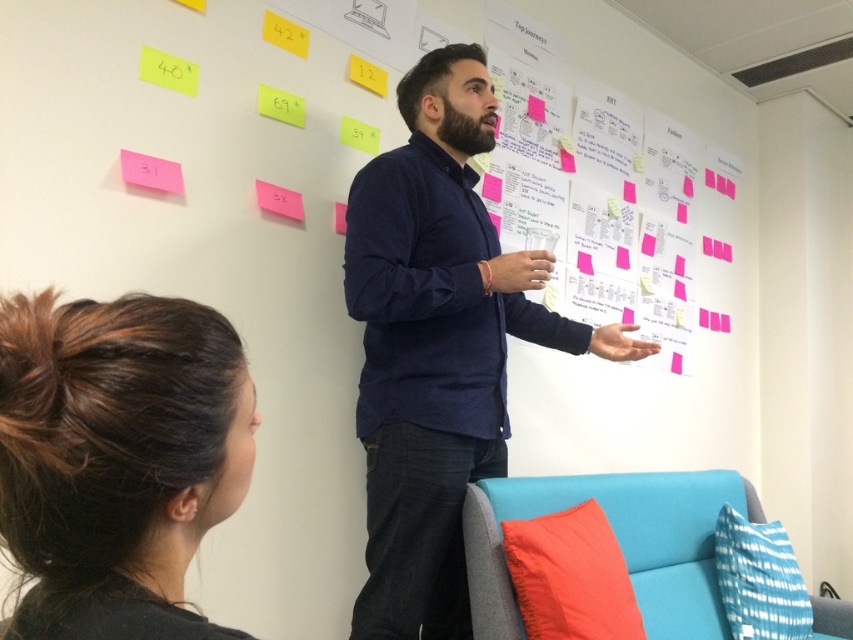
You are an observer in the office scene. You notice the dark blue shirt at center and the yellow paper at upper left. Which object is taller?

The dark blue shirt at center is taller than the yellow paper at upper left.

You are an observer in the office scene. You notice the dark brown hair at lower left and the pink paper at upper center. Which object has a greater width?

The dark brown hair at lower left has a greater width than the pink paper at upper center.

You are an observer in the office scene. You notice the dark blue shirt at center and the yellow paper at upper left. Which object takes up more visual space in the image?

The dark blue shirt at center takes up more visual space than the yellow paper at upper left because it is bigger.